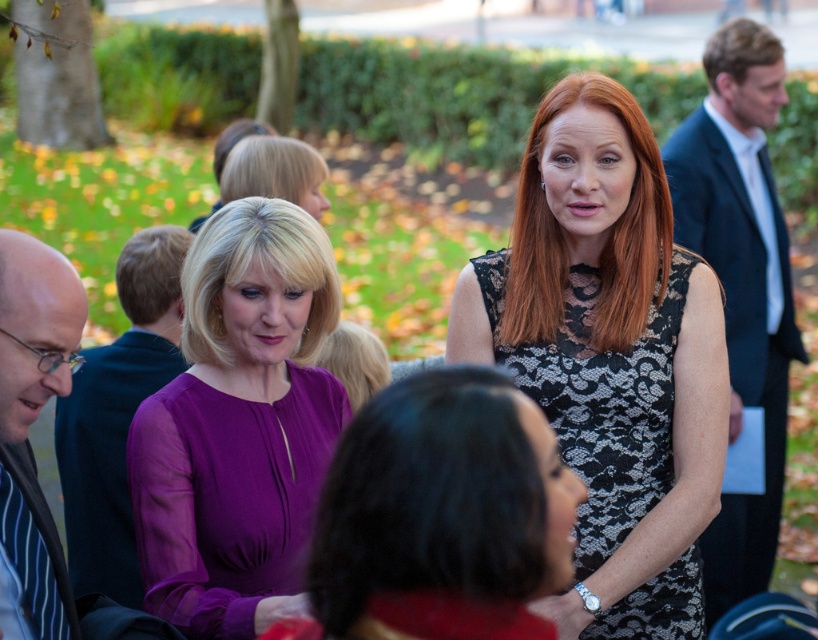
You are standing at the origin point in the image. There are two points marked in the scene. Which point, point (324, 237) or point (43, 348), is located behind the other?

Point (324, 237) is behind point (43, 348).

Consider the image. You are organizing a charity event and need to seat guests based on their attire. You have two guests wearing the dark blue suit at right and the matte black suit at left. Which guest should you seat in a larger chair to accommodate their suit?

The dark blue suit at right has a larger size compared to the matte black suit at left, so you should seat the guest wearing the dark blue suit at right in a larger chair.

You are at a park event and see two people wearing the black lace dress at center and the striped fabric shirt at left. Which one is positioned more to the left side of the scene?

The striped fabric shirt at left is positioned more to the left side of the scene compared to the black lace dress at center.